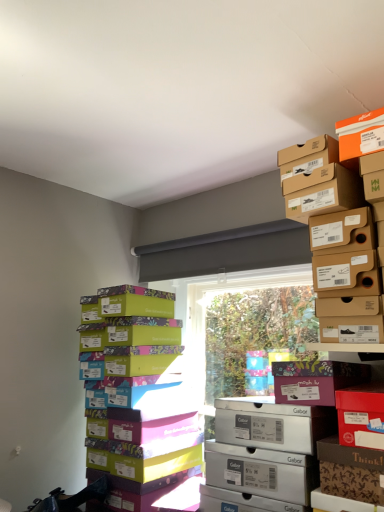
Question: Is white cardboard shoebox at center inside or outside of floral-patterned cardboard box at center-right, marked as the 1th cardboard box in a bottom-to-top arrangement?

Choices:
 (A) outside
 (B) inside

Answer: (A)

Question: In the image, is white cardboard shoebox at center positioned in front of or behind floral-patterned cardboard box at center-right, positioned as the second cardboard box in top-to-bottom order?

Choices:
 (A) behind
 (B) front

Answer: (B)

Question: Which of these objects is positioned farthest from the multicolored cardboard shoebox at left?

Choices:
 (A) matte brown shoebox at upper right, acting as the 1th cardboard box starting from the top
 (B) white cardboard shoebox at center
 (C) floral-patterned cardboard box at center-right, marked as the 1th cardboard box in a bottom-to-top arrangement

Answer: (A)

Question: Estimate the real-world distances between objects in this image. Which object is closer to the matte brown shoebox at upper right, which is the 2th cardboard box in bottom-to-top order?

Choices:
 (A) multicolored cardboard shoebox at left
 (B) white cardboard shoebox at center
 (C) floral-patterned cardboard box at center-right, marked as the 1th cardboard box in a bottom-to-top arrangement

Answer: (C)